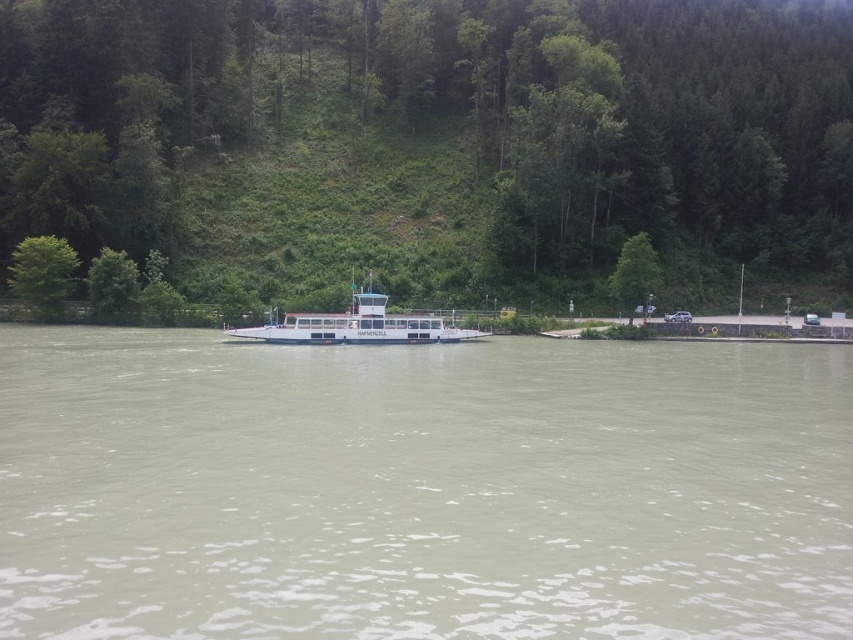
You are standing on the riverside and see the green leafy tree at center and the white glossy boat at center. Which object is larger in size?

The green leafy tree at center is bigger than the white glossy boat at center.

You are standing on the riverbank and want to take a photo of the white glossy boat at center and the green leafy tree at upper left. Which object should you point your camera towards first if you want to capture both in a single shot?

You should point your camera towards the green leafy tree at upper left first because the white glossy boat at center is below it, ensuring both are included in the frame.